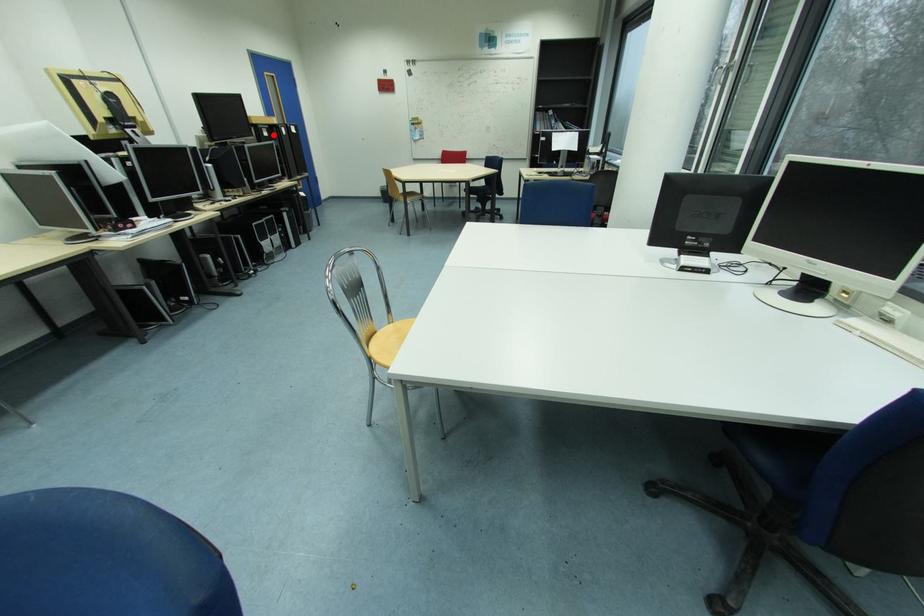
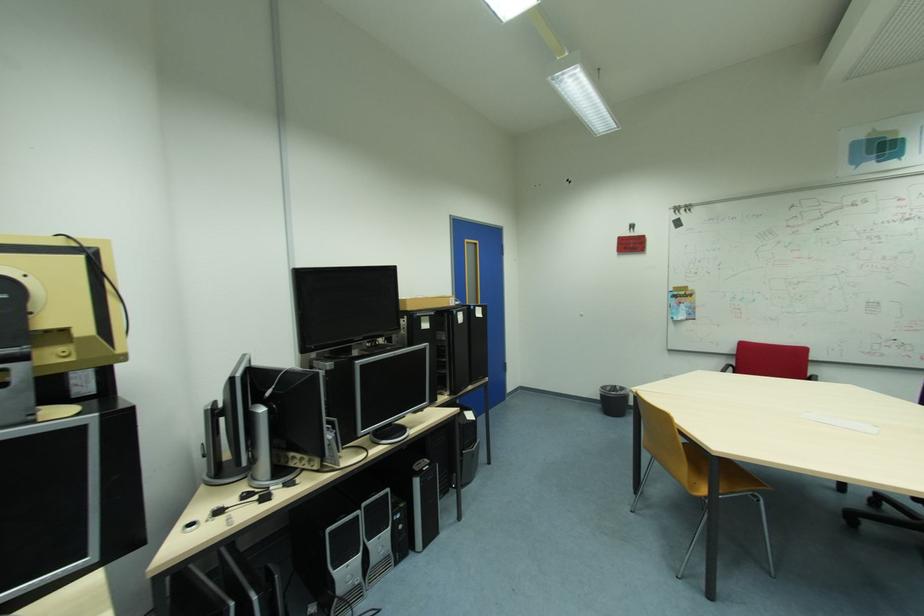
Locate, in the second image, the point that corresponds to the highlighted location in the first image.

(432, 326)